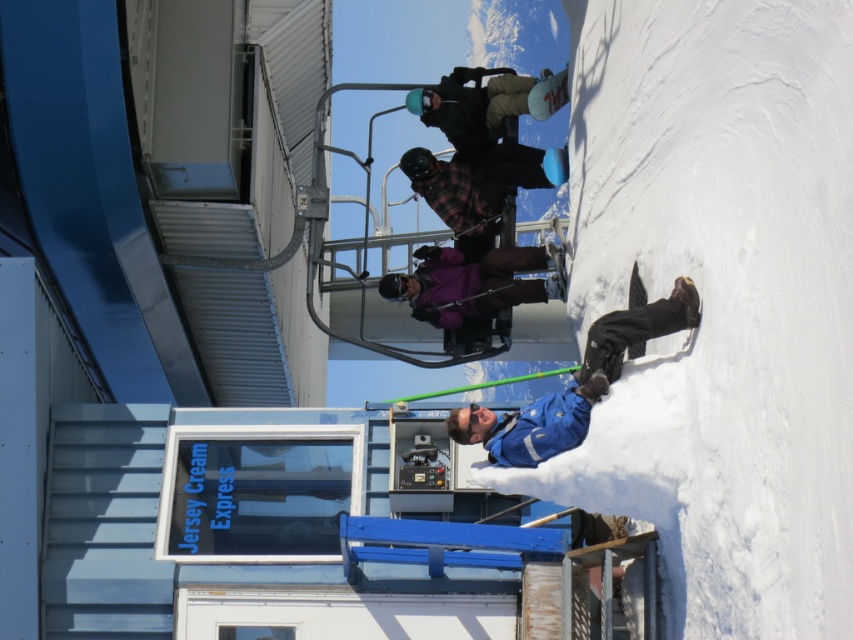
Who is shorter, plaid fabric shirt at center or matte black snowboard at upper center?

matte black snowboard at upper center is shorter.

In order to click on plaid fabric shirt at center in this screenshot , I will do `click(480, 186)`.

Where is `plaid fabric shirt at center`? plaid fabric shirt at center is located at coordinates (480, 186).

Does purple matte jacket at center appear on the right side of plaid fabric shirt at center?

Incorrect, purple matte jacket at center is not on the right side of plaid fabric shirt at center.

Is point (454, 291) farther from camera compared to point (511, 177)?

No, it is in front of (511, 177).

Where is `purple matte jacket at center`? purple matte jacket at center is located at coordinates (474, 282).

Is purple matte jacket at center to the right of blue fabric jacket at center from the viewer's perspective?

In fact, purple matte jacket at center is to the left of blue fabric jacket at center.

Can you confirm if purple matte jacket at center is positioned to the left of blue fabric jacket at center?

Yes, purple matte jacket at center is to the left of blue fabric jacket at center.

This screenshot has height=640, width=853. Describe the element at coordinates (474, 282) in the screenshot. I see `purple matte jacket at center` at that location.

The height and width of the screenshot is (640, 853). I want to click on purple matte jacket at center, so click(x=474, y=282).